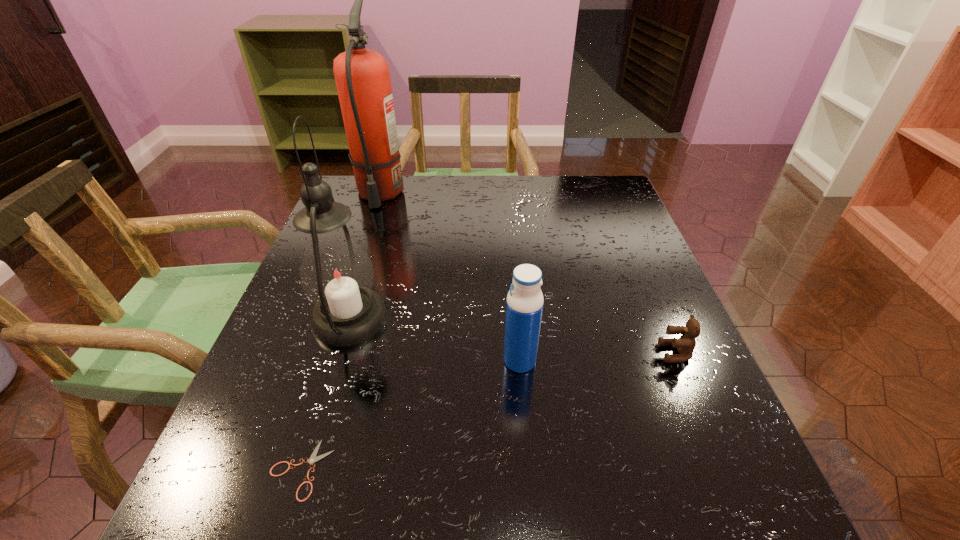
Where is `object that is positioned at the right edge`? object that is positioned at the right edge is located at coordinates (685, 345).

I want to click on object situated at the far left corner, so click(x=362, y=76).

Image resolution: width=960 pixels, height=540 pixels. Identify the location of object situated at the near left corner. (313, 458).

Image resolution: width=960 pixels, height=540 pixels. What are the coordinates of `vacant region at the far edge` in the screenshot? It's located at (428, 206).

Where is `free space at the near edge of the desktop`? This screenshot has width=960, height=540. free space at the near edge of the desktop is located at coordinates (550, 497).

The height and width of the screenshot is (540, 960). In order to click on free space at the left edge in this screenshot , I will do `click(289, 453)`.

Locate an element on the screen. Image resolution: width=960 pixels, height=540 pixels. free space at the right edge of the desktop is located at coordinates (636, 234).

You are a GUI agent. You are given a task and a screenshot of the screen. Output one action in this format:
    pyautogui.click(x=<x>, y=<y>)
    Task: Click on the vacant area that lies between the shortest object and the third shortest object
    This screenshot has width=960, height=540.
    Given the screenshot: What is the action you would take?
    pyautogui.click(x=410, y=415)

Identify the location of unoccupied area between the fourth tallest object and the water bottle. (597, 357).

Where is `free space between the fourth object from left to right and the oil lamp`? This screenshot has width=960, height=540. free space between the fourth object from left to right and the oil lamp is located at coordinates (435, 340).